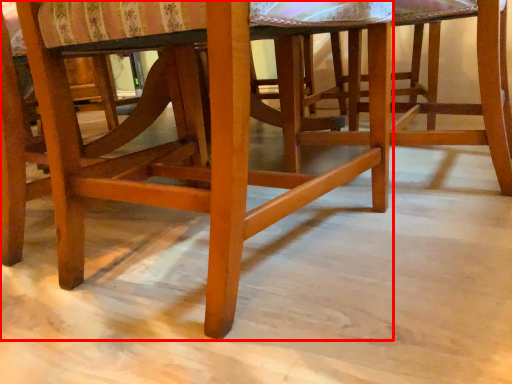
Question: From the image's perspective, where is chair (annotated by the red box) located in relation to stool in the image?

Choices:
 (A) above
 (B) below

Answer: (B)